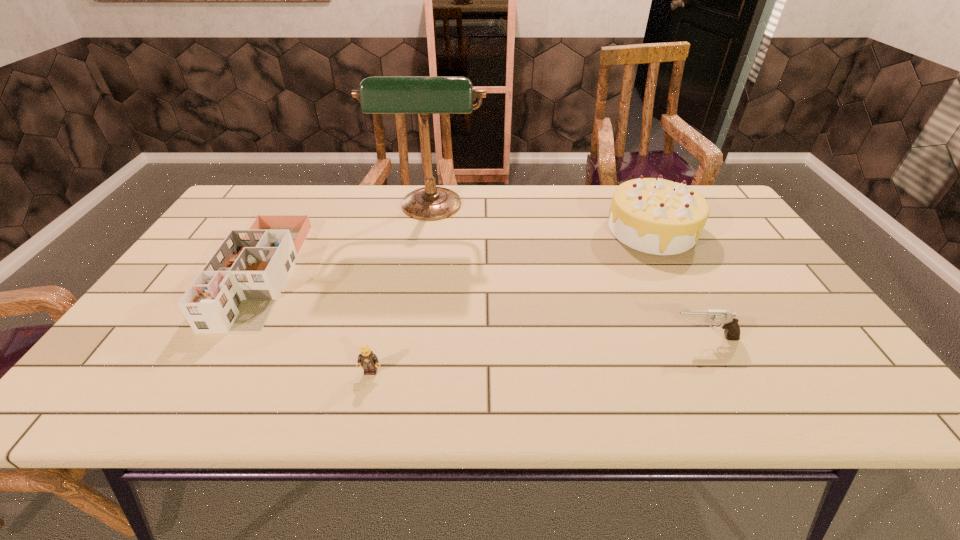
Locate an element on the screen. free space located at the muzzle of the gun is located at coordinates (639, 338).

Locate an element on the screen. vacant space located 0.070m in front of the nearest object is located at coordinates (363, 404).

At what (x,y) coordinates should I click in order to perform the action: click on table lamp that is at the far edge. Please return your answer as a coordinate pair (x, y). The width and height of the screenshot is (960, 540). Looking at the image, I should click on (424, 95).

Where is `birthday cake that is at the far edge`? birthday cake that is at the far edge is located at coordinates (652, 215).

You are a GUI agent. You are given a task and a screenshot of the screen. Output one action in this format:
    pyautogui.click(x=<x>, y=<y>)
    Task: Click on the object at the near edge
    This screenshot has width=960, height=540.
    Given the screenshot: What is the action you would take?
    pyautogui.click(x=367, y=359)

The width and height of the screenshot is (960, 540). What are the coordinates of `object that is at the left edge` in the screenshot? It's located at (235, 292).

This screenshot has width=960, height=540. In order to click on object located at the right edge in this screenshot , I will do pyautogui.click(x=652, y=215).

Where is `object at the far right corner`? This screenshot has width=960, height=540. object at the far right corner is located at coordinates (652, 215).

In the image, there is a desktop. At what (x,y) coordinates should I click in order to perform the action: click on vacant space at the far edge. Please return your answer as a coordinate pair (x, y). This screenshot has width=960, height=540. Looking at the image, I should click on (467, 189).

I want to click on free region at the near edge, so click(x=493, y=373).